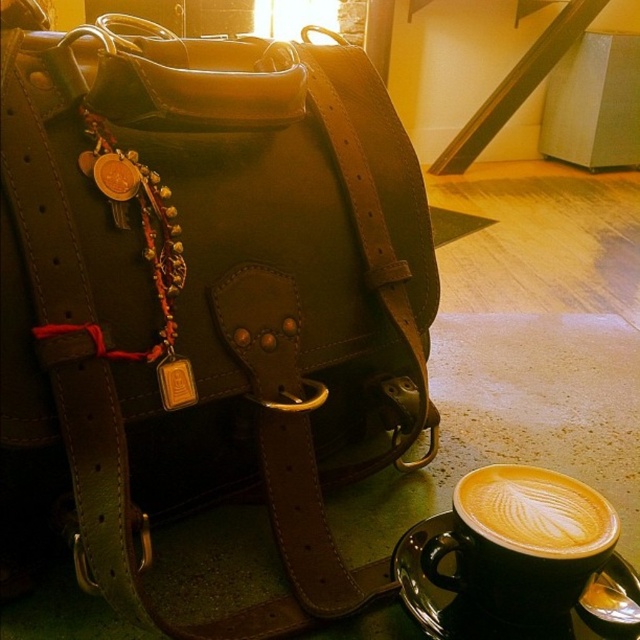
Question: Estimate the real-world distances between objects in this image. Which object is farther from the cappuccino foam at lower right?

Choices:
 (A) golden frothy latte at lower right
 (B) brown leather bag at center

Answer: (B)

Question: Is brown leather bag at center smaller than golden frothy latte at lower right?

Choices:
 (A) yes
 (B) no

Answer: (B)

Question: Does brown leather bag at center appear on the right side of cappuccino foam at lower right?

Choices:
 (A) yes
 (B) no

Answer: (B)

Question: Which point is closer to the camera taking this photo?

Choices:
 (A) (579, 515)
 (B) (579, 529)
 (C) (262, 164)

Answer: (B)

Question: Among these points, which one is farthest from the camera?

Choices:
 (A) (512, 570)
 (B) (301, 504)

Answer: (B)

Question: Can you confirm if brown leather bag at center is bigger than golden frothy latte at lower right?

Choices:
 (A) yes
 (B) no

Answer: (A)